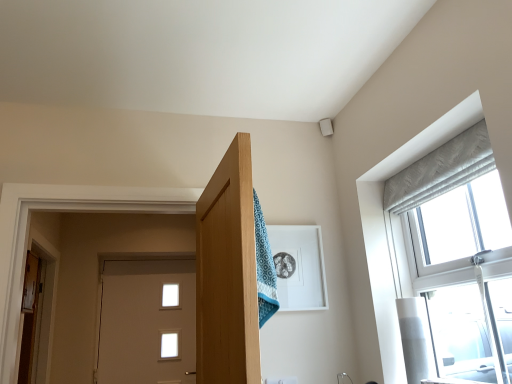
Question: Are white glossy door at center, which is the 2th door from left to right, and wooden door at left, the first door positioned from the front, located far from each other?

Choices:
 (A) yes
 (B) no

Answer: (B)

Question: Is white glossy door at center, which is the 2th door from left to right, wider than wooden door at left, acting as the second door starting from the back?

Choices:
 (A) yes
 (B) no

Answer: (A)

Question: Considering the relative sizes of white glossy door at center, acting as the second door starting from the front, and wooden door at left, the second door positioned from the right, in the image provided, is white glossy door at center, acting as the second door starting from the front, taller than wooden door at left, the second door positioned from the right,?

Choices:
 (A) yes
 (B) no

Answer: (A)

Question: Is white glossy door at center, acting as the second door starting from the front, to the left of wooden door at left, acting as the second door starting from the back, from the viewer's perspective?

Choices:
 (A) yes
 (B) no

Answer: (B)

Question: From a real-world perspective, is white glossy door at center, which is the 1th door in right-to-left order, on top of wooden door at left, acting as the second door starting from the back?

Choices:
 (A) no
 (B) yes

Answer: (A)

Question: Does white glossy door at center, which is the 1th door in right-to-left order, turn towards wooden door at left, the first door positioned from the left?

Choices:
 (A) no
 (B) yes

Answer: (A)

Question: Is wooden door at left, the first door positioned from the left, located outside white glossy door at center, which is the 1th door in right-to-left order?

Choices:
 (A) yes
 (B) no

Answer: (A)

Question: Is wooden door at left, the first door positioned from the front, at the right side of white glossy door at center, acting as the second door starting from the front?

Choices:
 (A) yes
 (B) no

Answer: (B)

Question: Is wooden door at left, acting as the second door starting from the back, turned away from white glossy door at center, acting as the second door starting from the front?

Choices:
 (A) yes
 (B) no

Answer: (B)

Question: From the image's perspective, is wooden door at left, the first door positioned from the front, over white glossy door at center, acting as the second door starting from the front?

Choices:
 (A) yes
 (B) no

Answer: (A)

Question: Can white glossy door at center, arranged as the 1th door when viewed from the back, be found inside wooden door at left, the second door positioned from the right?

Choices:
 (A) yes
 (B) no

Answer: (B)

Question: Is wooden door at left, the first door positioned from the left, thinner than white glossy door at center, arranged as the 1th door when viewed from the back?

Choices:
 (A) yes
 (B) no

Answer: (A)

Question: From a real-world perspective, is white glossy door at center, arranged as the 1th door when viewed from the back, above or below wooden door at left, acting as the second door starting from the back?

Choices:
 (A) below
 (B) above

Answer: (A)